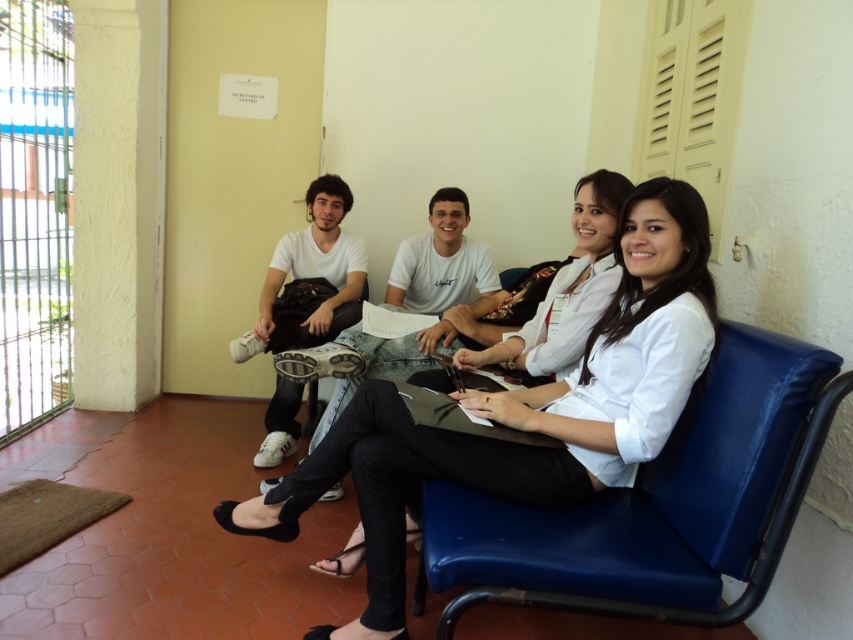
Question: Is blue leather chair at center thinner than white matte shirt at center?

Choices:
 (A) no
 (B) yes

Answer: (B)

Question: Which point appears closest to the camera in this image?

Choices:
 (A) (402, 636)
 (B) (335, 273)
 (C) (454, 570)

Answer: (C)

Question: Can you confirm if white matte shirt at center is positioned above white matte sneakers at left?

Choices:
 (A) no
 (B) yes

Answer: (A)

Question: Is the position of blue leather chair at center less distant than that of white matte sneakers at left?

Choices:
 (A) yes
 (B) no

Answer: (A)

Question: Which point is closer to the camera?

Choices:
 (A) pyautogui.click(x=741, y=465)
 (B) pyautogui.click(x=328, y=241)
 (C) pyautogui.click(x=567, y=445)

Answer: (A)

Question: Estimate the real-world distances between objects in this image. Which object is closer to the white matte sneakers at left?

Choices:
 (A) white matte shirt at center
 (B) blue leather chair at center

Answer: (A)